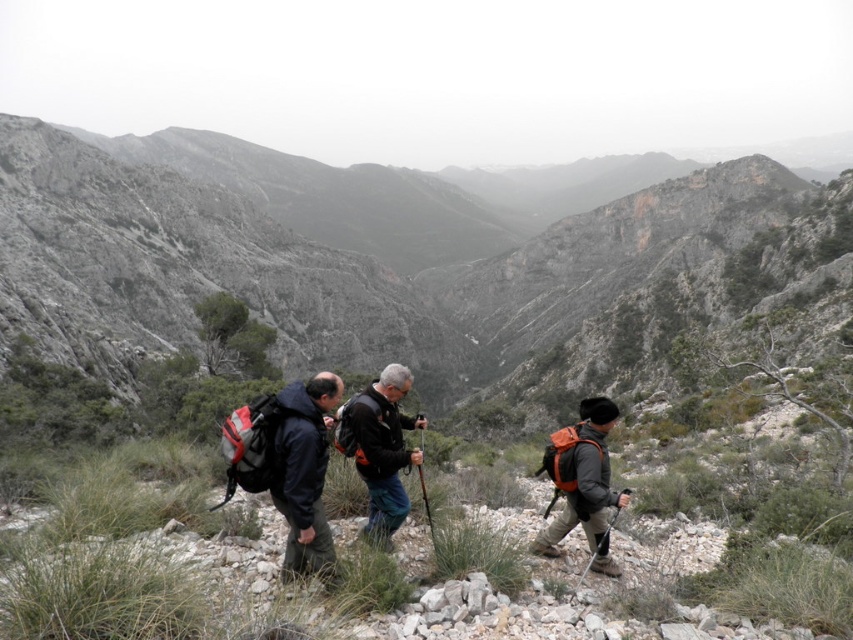
How far apart are dark blue jacket at center and orange fabric backpack at right?

The distance of dark blue jacket at center from orange fabric backpack at right is 6.84 meters.

Can you confirm if dark blue jacket at center is taller than orange fabric backpack at right?

Indeed, dark blue jacket at center has a greater height compared to orange fabric backpack at right.

Is point (416, 416) more distant than point (567, 524)?

That is True.

Find the location of a particular element. dark blue jacket at center is located at coordinates (373, 442).

Does rugged stone mountain at center have a larger size compared to orange fabric backpack at right?

Correct, rugged stone mountain at center is larger in size than orange fabric backpack at right.

Who is lower down, rugged stone mountain at center or orange fabric backpack at right?

Positioned lower is orange fabric backpack at right.

Between point (575, 388) and point (575, 435), which one is positioned behind?

Positioned behind is point (575, 388).

This screenshot has height=640, width=853. Identify the location of rugged stone mountain at center. (398, 262).

Measure the distance between rugged stone mountain at center and camera.

They are 37.28 meters apart.

In order to click on rugged stone mountain at center in this screenshot , I will do `click(398, 262)`.